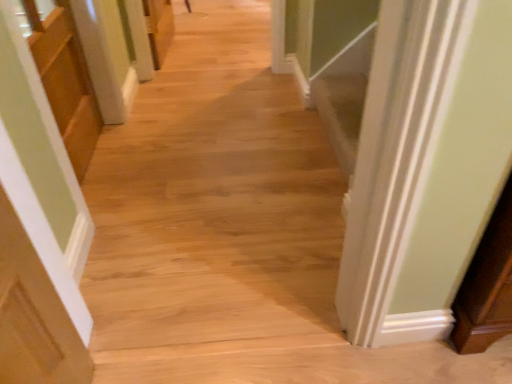
Where is `matte wood cabinet at left`? This screenshot has width=512, height=384. matte wood cabinet at left is located at coordinates (65, 80).

Describe the element at coordinates (65, 80) in the screenshot. The height and width of the screenshot is (384, 512). I see `matte wood cabinet at left` at that location.

In the scene shown: Measure the distance between point (x=101, y=117) and camera.

Point (x=101, y=117) and camera are 7.12 feet apart.

Locate an element on the screen. natural wood floor at center is located at coordinates (214, 205).

The width and height of the screenshot is (512, 384). Describe the element at coordinates (214, 205) in the screenshot. I see `natural wood floor at center` at that location.

Image resolution: width=512 pixels, height=384 pixels. In order to click on matte wood cabinet at left in this screenshot , I will do `click(65, 80)`.

Looking at this image, considering the positions of objects matte wood cabinet at left and natural wood floor at center in the image provided, who is more to the right, matte wood cabinet at left or natural wood floor at center?

natural wood floor at center.

Which object is closer to the camera taking this photo, matte wood cabinet at left or natural wood floor at center?

natural wood floor at center is closer to the camera.

Considering the positions of point (60, 104) and point (141, 225), is point (60, 104) closer or farther from the camera than point (141, 225)?

Clearly, point (60, 104) is more distant from the camera than point (141, 225).

From the image's perspective, is matte wood cabinet at left above or below natural wood floor at center?

matte wood cabinet at left is above natural wood floor at center.

From a real-world perspective, is matte wood cabinet at left positioned under natural wood floor at center based on gravity?

Yes, from a real-world perspective, matte wood cabinet at left is below natural wood floor at center.

In the scene shown: Which of these two, matte wood cabinet at left or natural wood floor at center, is wider?

With larger width is natural wood floor at center.

Which of these two, matte wood cabinet at left or natural wood floor at center, stands taller?

Standing taller between the two is natural wood floor at center.

Who is smaller, matte wood cabinet at left or natural wood floor at center?

matte wood cabinet at left.

Is matte wood cabinet at left located outside natural wood floor at center?

Yes.

Is matte wood cabinet at left not near natural wood floor at center?

matte wood cabinet at left is actually quite close to natural wood floor at center.

Is matte wood cabinet at left facing away from natural wood floor at center?

No.

How many degrees apart are the facing directions of matte wood cabinet at left and natural wood floor at center?

90.7 degrees.

Identify the location of aisle that appears below the matte wood cabinet at left (from the image's perspective). (214, 205).

Between natural wood floor at center and matte wood cabinet at left, which one appears on the left side from the viewer's perspective?

matte wood cabinet at left is more to the left.

Consider the image. Is natural wood floor at center further to the viewer compared to matte wood cabinet at left?

That is False.

Which is nearer, (256,231) or (53,71)?

Point (256,231) is positioned closer to the camera compared to point (53,71).

From the picture: From the image's perspective, is natural wood floor at center over matte wood cabinet at left?

Incorrect, from the image's perspective, natural wood floor at center is lower than matte wood cabinet at left.

From a real-world perspective, which is physically above, natural wood floor at center or matte wood cabinet at left?

natural wood floor at center, from a real-world perspective.

Considering the sizes of objects natural wood floor at center and matte wood cabinet at left in the image provided, who is thinner, natural wood floor at center or matte wood cabinet at left?

matte wood cabinet at left is thinner.

Based on the photo, in terms of height, does natural wood floor at center look taller or shorter compared to matte wood cabinet at left?

Considering their sizes, natural wood floor at center has more height than matte wood cabinet at left.

Considering the relative sizes of natural wood floor at center and matte wood cabinet at left in the image provided, is natural wood floor at center smaller than matte wood cabinet at left?

Actually, natural wood floor at center might be larger than matte wood cabinet at left.

Is natural wood floor at center not inside matte wood cabinet at left?

Indeed, natural wood floor at center is completely outside matte wood cabinet at left.

Based on the photo, is natural wood floor at center not close to matte wood cabinet at left?

No, natural wood floor at center is not far from matte wood cabinet at left.

Is natural wood floor at center turned away from matte wood cabinet at left?

Yes, natural wood floor at center is positioned with its back facing matte wood cabinet at left.

How different are the orientations of natural wood floor at center and matte wood cabinet at left in degrees?

The angle between the facing direction of natural wood floor at center and the facing direction of matte wood cabinet at left is 90.7 degrees.

Find the location of `cabinetry below the natural wood floor at center (from a real-world perspective)`. cabinetry below the natural wood floor at center (from a real-world perspective) is located at coordinates (65, 80).

Locate an element on the screen. This screenshot has height=384, width=512. cabinetry behind the natural wood floor at center is located at coordinates (65, 80).

Find the location of `cabinetry on the left side of natural wood floor at center`. cabinetry on the left side of natural wood floor at center is located at coordinates (65, 80).